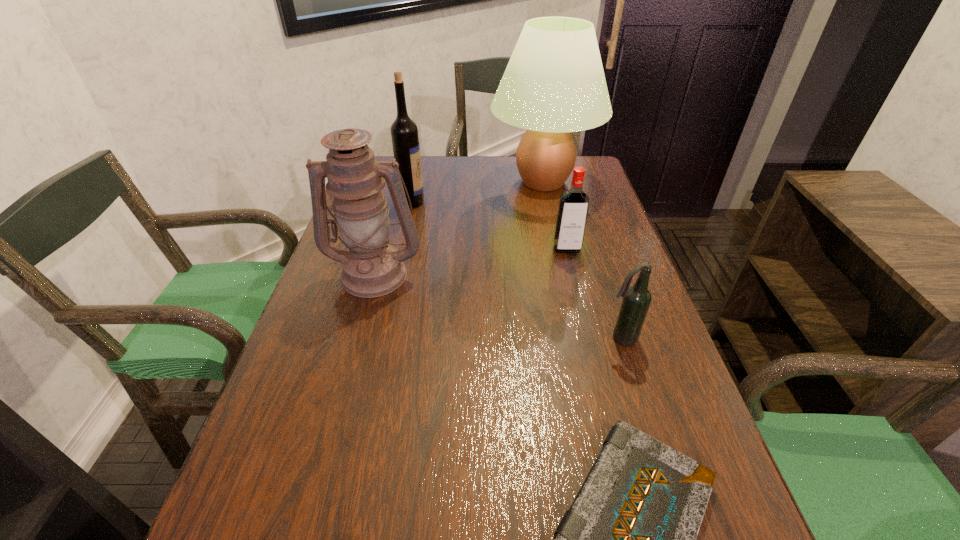
Locate an element on the screen. lampshade is located at coordinates point(554,84).

Where is `wine bottle`? wine bottle is located at coordinates (404, 132).

Find the location of a particular element. oil lamp is located at coordinates (372, 267).

The height and width of the screenshot is (540, 960). In order to click on vodka in this screenshot , I will do (573, 207).

Locate an element on the screen. The height and width of the screenshot is (540, 960). the second nearest object is located at coordinates (636, 301).

Where is `vacant area situated 0.300m on the shade of the lampshade`? This screenshot has width=960, height=540. vacant area situated 0.300m on the shade of the lampshade is located at coordinates (396, 182).

Image resolution: width=960 pixels, height=540 pixels. I want to click on vacant space located 0.240m on the shade of the lampshade, so click(415, 182).

The width and height of the screenshot is (960, 540). Find the location of `vacant area situated 0.220m on the shade of the lampshade`. vacant area situated 0.220m on the shade of the lampshade is located at coordinates (420, 182).

Locate an element on the screen. free location located on the label of the wine bottle is located at coordinates (538, 201).

Find the location of a particular element. This screenshot has height=540, width=960. vacant point located 0.140m on the front of the oil lamp is located at coordinates (355, 346).